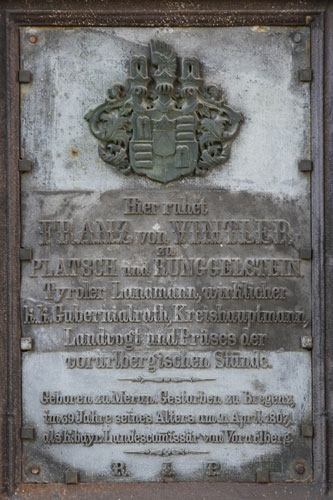
Where is `statue`? statue is located at coordinates (166, 406).